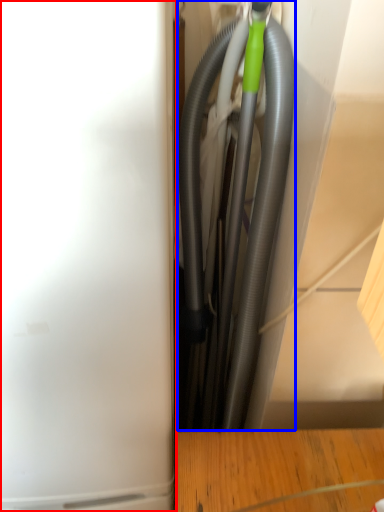
Question: Which point is closer to the camera, appliance (highlighted by a red box) or garden hose (highlighted by a blue box)?

Choices:
 (A) appliance
 (B) garden hose

Answer: (A)